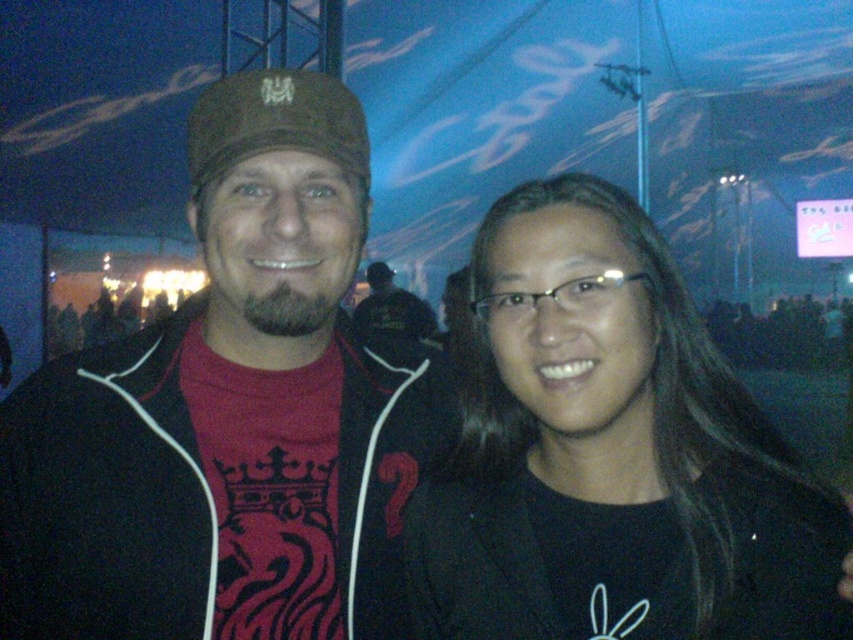
Based on the photo, you are organizing a photo shoot and need to ensure that the matte black jacket at center and the black matte glasses at center are clearly visible in the frame. Given their sizes, which object should you focus on first to ensure proper focus?

The matte black jacket at center has a larger size compared to the black matte glasses at center, so you should focus on the matte black jacket at center first to ensure proper focus since it occupies more space in the frame.

You are taking a photo of two people at an event. You notice the matte black jacket at center and the black matte glasses at center. Which object is located to the left of the other?

The matte black jacket at center is positioned on the left side of black matte glasses at center.

You are standing at the point marked at coordinates (x=229, y=413) in the image. Looking around, you see a matte black jacket at center. What object is directly beneath your feet?

The point at (x=229, y=413) is on the matte black jacket at center, so the object directly beneath your feet is the matte black jacket at center.